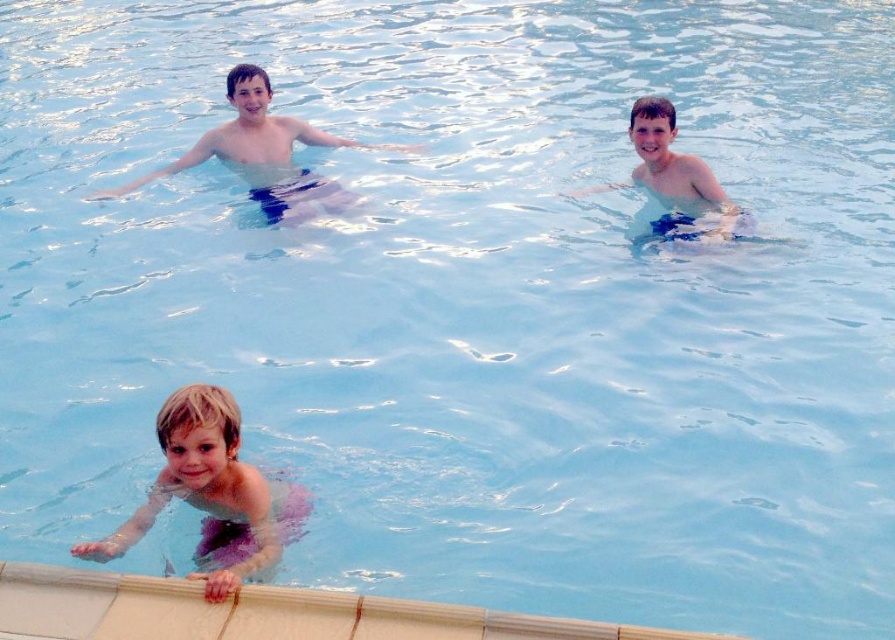
In the scene shown: You are a lifeguard observing two children in the swimming pool. You notice the matte blue shorts at upper center and the blue fabric shorts at upper center. Which child is wearing the larger pair of shorts?

The matte blue shorts at upper center is larger in size than the blue fabric shorts at upper center, so the child wearing the matte blue shorts at upper center has the larger pair of shorts.

You are designing a swimsuit catalog and need to know which item takes up more visual space in the image for layout purposes. Which between the pink fabric at lower left and the matte blue shorts at upper center is larger in size?

The matte blue shorts at upper center occupies more visual space than the pink fabric at lower left, so it is larger in size.

You are a photographer trying to capture the child with the matte blue shorts at upper center and the blue fabric shorts at upper center. Which of the two is positioned higher in the water?

The matte blue shorts at upper center is located above the blue fabric shorts at upper center, so the child wearing the matte blue shorts at upper center is positioned higher in the water.